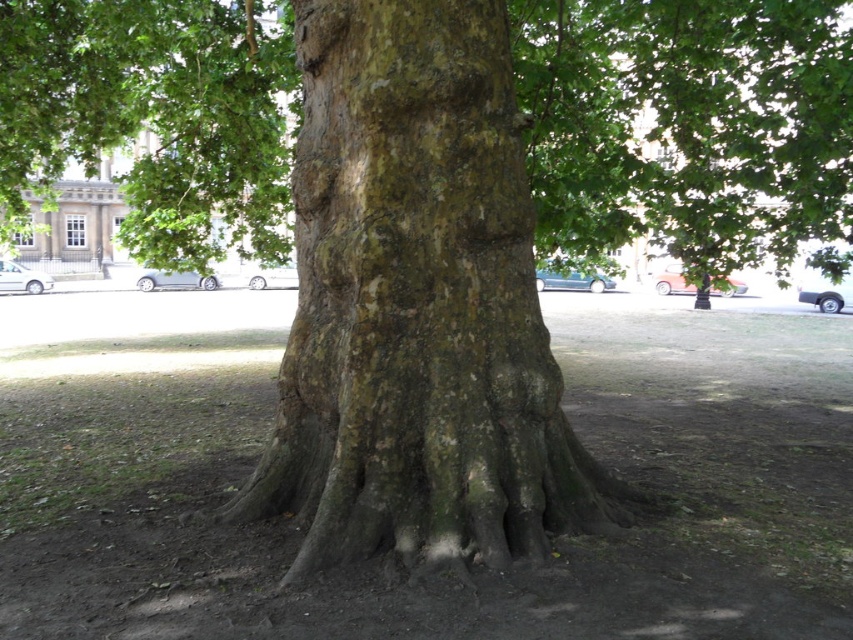
Is green mossy bark at center taller than smooth bark tree at center?

Incorrect, green mossy bark at center's height is not larger of smooth bark tree at center's.

Is green mossy bark at center wider than smooth bark tree at center?

No.

Is point (426, 140) less distant than point (198, 113)?

Yes, it is in front of point (198, 113).

You are a GUI agent. You are given a task and a screenshot of the screen. Output one action in this format:
    pyautogui.click(x=<x>, y=<y>)
    Task: Click on the green mossy bark at center
    
    Given the screenshot: What is the action you would take?
    pyautogui.click(x=416, y=305)